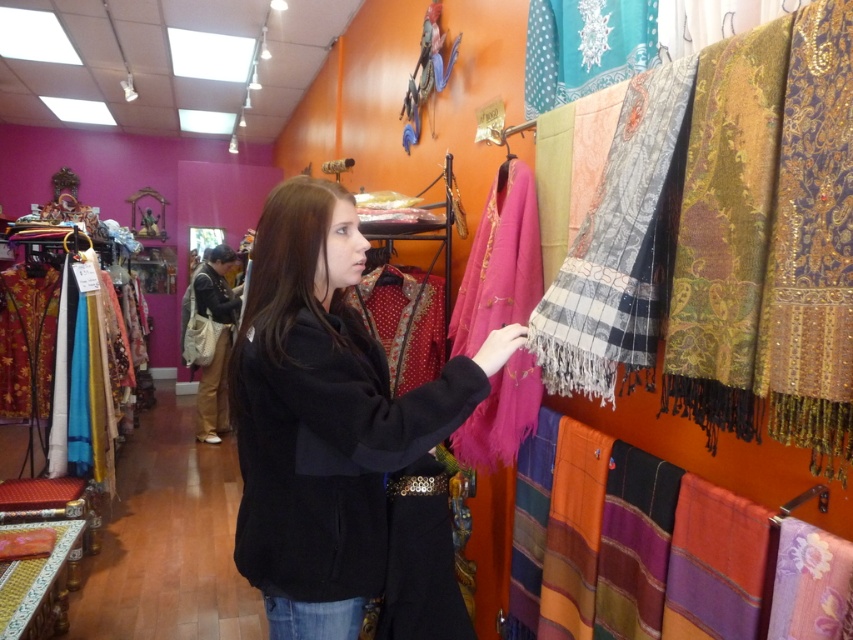
Question: In this image, where is black woolen coat at center located relative to striped cotton scarf at lower right?

Choices:
 (A) right
 (B) left

Answer: (B)

Question: Considering the real-world distances, which object is farthest from the teal dotted scarf at upper right?

Choices:
 (A) beige fabric at center
 (B) striped cotton scarf at lower right
 (C) pink woven scarf at center
 (D) black woolen coat at center

Answer: (A)

Question: Is pink woven scarf at center below multicolored woven scarf at right?

Choices:
 (A) yes
 (B) no

Answer: (B)

Question: Does striped cotton scarf at lower right have a lesser width compared to beige fabric at center?

Choices:
 (A) yes
 (B) no

Answer: (A)

Question: Which object is closer to the camera taking this photo?

Choices:
 (A) teal dotted scarf at upper right
 (B) multicolored woven scarf at right

Answer: (A)

Question: Which point is farther from the camera taking this photo?

Choices:
 (A) (573, 60)
 (B) (572, 596)

Answer: (A)